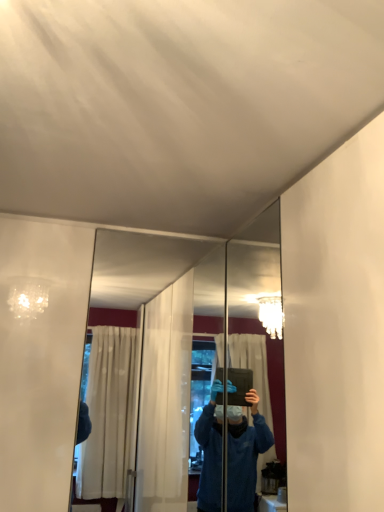
Question: Considering the positions of clear glass mirror at center, the 2th mirror when ordered from right to left, and polished silver mirror at center, the second mirror viewed from the left, in the image, is clear glass mirror at center, the 2th mirror when ordered from right to left, wider or thinner than polished silver mirror at center, the second mirror viewed from the left,?

Choices:
 (A) wide
 (B) thin

Answer: (B)

Question: Visually, is clear glass mirror at center, the 1th mirror when ordered from left to right, positioned to the left or to the right of polished silver mirror at center, the second mirror viewed from the left?

Choices:
 (A) left
 (B) right

Answer: (A)

Question: Relative to polished silver mirror at center, acting as the first mirror starting from the right, is clear glass mirror at center, the 2th mirror when ordered from right to left, in front or behind?

Choices:
 (A) behind
 (B) front

Answer: (A)

Question: Do you think polished silver mirror at center, acting as the first mirror starting from the right, is within clear glass mirror at center, the 2th mirror when ordered from right to left, or outside of it?

Choices:
 (A) inside
 (B) outside

Answer: (B)

Question: Looking at the image, does polished silver mirror at center, the second mirror viewed from the left, seem bigger or smaller compared to clear glass mirror at center, the 1th mirror when ordered from left to right?

Choices:
 (A) big
 (B) small

Answer: (A)

Question: Looking at their shapes, would you say polished silver mirror at center, the second mirror viewed from the left, is wider or thinner than clear glass mirror at center, the 2th mirror when ordered from right to left?

Choices:
 (A) thin
 (B) wide

Answer: (B)

Question: Considering the positions of point (240, 237) and point (104, 342), is point (240, 237) closer or farther from the camera than point (104, 342)?

Choices:
 (A) closer
 (B) farther

Answer: (A)